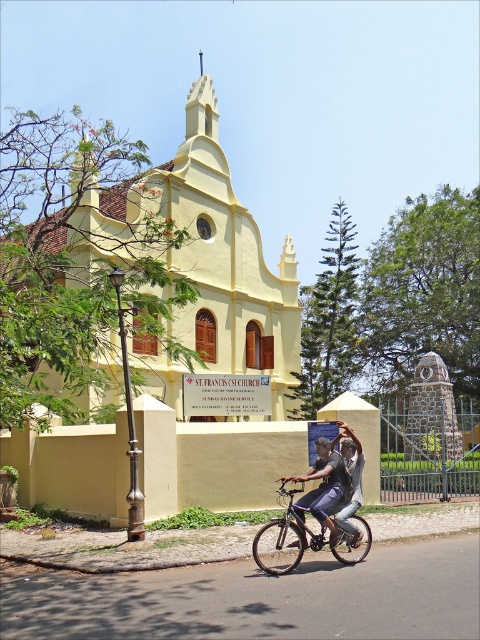
You are standing in front of the church and want to take a photo of the signboard. Where should you position yourself relative to the denim shorts at center to ensure the signboard is fully visible in the frame?

The denim shorts at center is located at point [324,486], so you should position yourself to the left or right of the denim shorts at center to ensure the signboard is fully visible in the frame.

You are standing in front of the church and notice two objects at the center. Which object is closer to you, the yellow matte church at center or the denim pants at center?

The yellow matte church at center is closer to you because the denim pants at center is behind it.

You are standing in front of the church and see two items at the center of the image. Which one is positioned lower between the denim shorts at center and the denim pants at center?

The denim shorts at center is located below denim pants at center, so it is positioned lower.